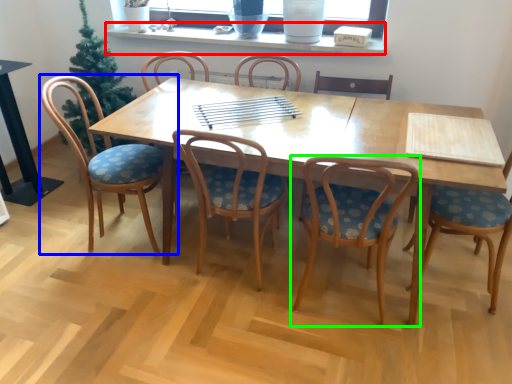
Question: Which object is positioned closest to window sill (highlighted by a red box)? Select from chair (highlighted by a blue box) and chair (highlighted by a green box).

Choices:
 (A) chair
 (B) chair

Answer: (A)